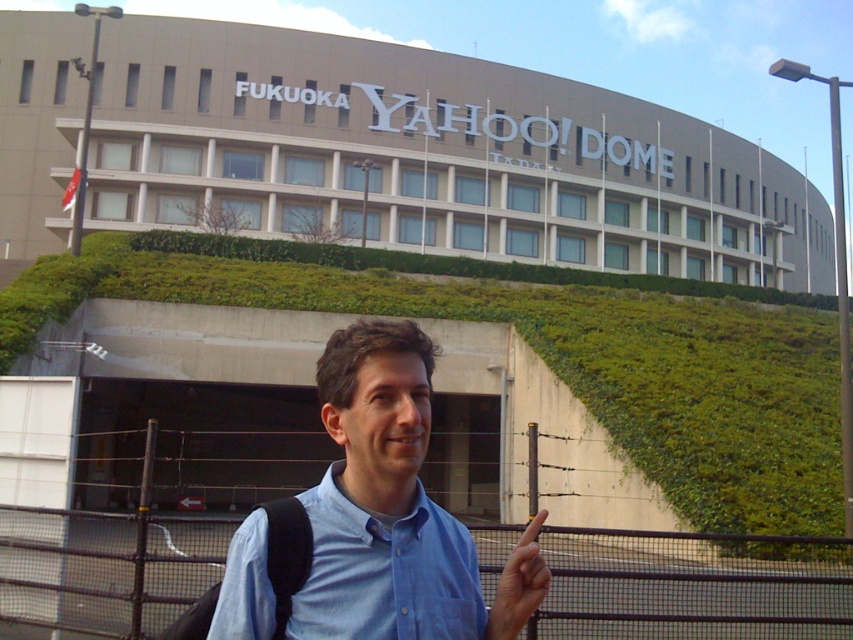
Question: Which of the following is the closest to the observer?

Choices:
 (A) 401,566
 (B) 345,636
 (C) 520,572

Answer: (B)

Question: Is blue cotton shirt at center positioned behind blue cotton shirt at lower center?

Choices:
 (A) yes
 (B) no

Answer: (A)

Question: Which of these objects is positioned farthest from the blue cotton shirt at lower center?

Choices:
 (A) blue cotton shirt at center
 (B) skinny finger at center

Answer: (B)

Question: Which object is farther from the camera taking this photo?

Choices:
 (A) blue cotton shirt at lower center
 (B) skinny finger at center

Answer: (B)

Question: Observing the image, what is the correct spatial positioning of blue cotton shirt at lower center in reference to skinny finger at center?

Choices:
 (A) above
 (B) below

Answer: (A)

Question: Where is blue cotton shirt at center located in relation to blue cotton shirt at lower center in the image?

Choices:
 (A) above
 (B) below

Answer: (B)